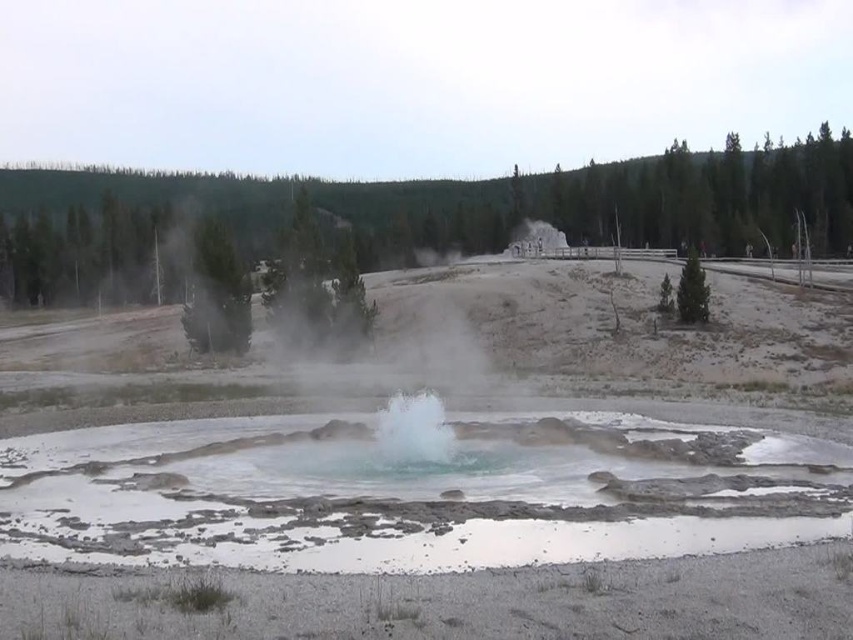
You are a park ranger guiding visitors around the geothermal area. You see the translucent blue water at center and the white frothy steam at center. Which one is more to the left?

The translucent blue water at center is more to the left side of the white frothy steam at center.

You are a park ranger assessing the safety of the geothermal area. You notice the translucent blue water at center and the white frothy steam at center. Which object is positioned closer to the visitors standing at the wooden fence? Please state the name of the object.

The translucent blue water at center is closer to the visitors standing at the wooden fence than the white frothy steam at center.